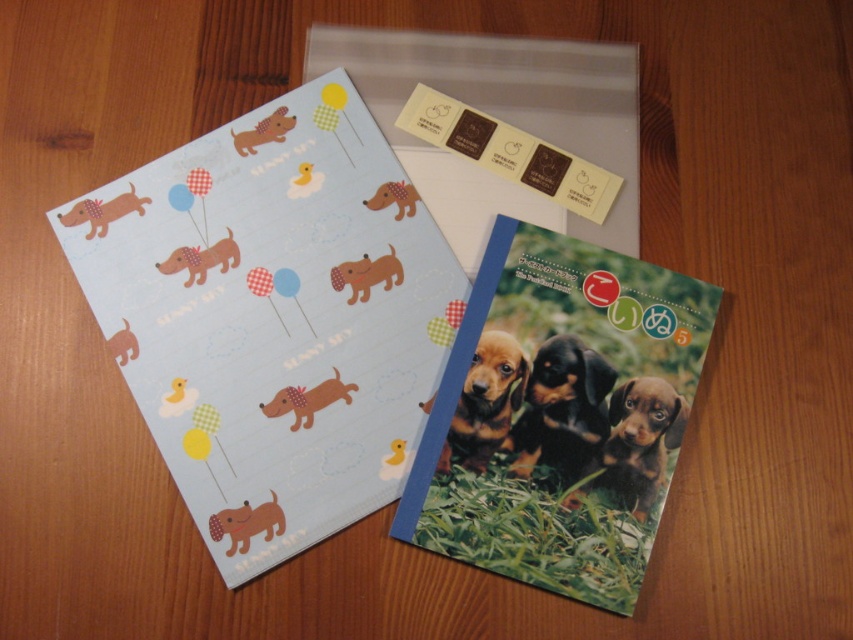
Can you confirm if brown glossy dog at center is thinner than matte brown dog at lower left?

No.

Is brown glossy dog at center shorter than matte brown dog at lower left?

No, brown glossy dog at center is not shorter than matte brown dog at lower left.

Is point (486, 454) closer to camera compared to point (241, 509)?

No.

At what (x,y) coordinates should I click in order to perform the action: click on brown glossy dog at center. Please return your answer as a coordinate pair (x, y). This screenshot has height=640, width=853. Looking at the image, I should click on (486, 401).

Which is in front, point (155, 349) or point (250, 532)?

Point (250, 532) is in front.

At what (x,y) coordinates should I click in order to perform the action: click on matte paper postcard at upper left. Please return your answer as a coordinate pair (x, y). This screenshot has height=640, width=853. Looking at the image, I should click on (273, 312).

Can you confirm if black and tan fur puppies at center is bigger than matte brown dog at lower left?

Correct, black and tan fur puppies at center is larger in size than matte brown dog at lower left.

Based on the photo, is black and tan fur puppies at center shorter than matte brown dog at lower left?

In fact, black and tan fur puppies at center may be taller than matte brown dog at lower left.

Who is more distant from viewer, [527,388] or [258,508]?

Positioned behind is point [527,388].

Where is `black and tan fur puppies at center`? The image size is (853, 640). black and tan fur puppies at center is located at coordinates (561, 410).